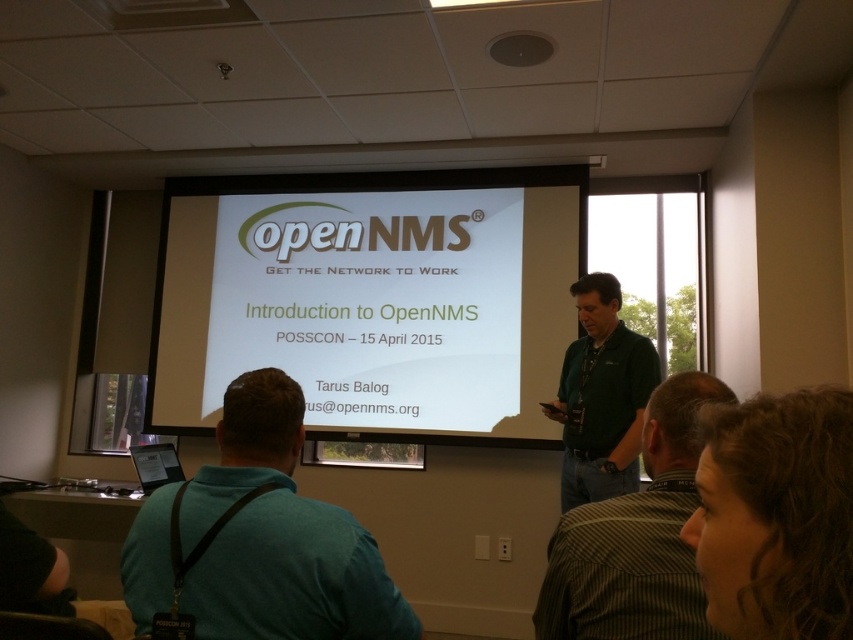
Question: Which of the following is the farthest from the observer?

Choices:
 (A) (x=598, y=515)
 (B) (x=300, y=512)

Answer: (A)

Question: Which object appears farthest from the camera in this image?

Choices:
 (A) teal fabric shirt at lower left
 (B) white glossy projector screen at center
 (C) green shirt at center
 (D) green fabric shirt at center

Answer: (B)

Question: Observing the image, what is the correct spatial positioning of white glossy projector screen at center in reference to green fabric shirt at center?

Choices:
 (A) below
 (B) above

Answer: (B)

Question: Is green shirt at center thinner than green fabric shirt at center?

Choices:
 (A) yes
 (B) no

Answer: (A)

Question: Which object is closer to the camera taking this photo?

Choices:
 (A) white glossy projector screen at center
 (B) green shirt at center
 (C) green fabric shirt at center
 (D) teal fabric shirt at lower left

Answer: (B)

Question: Does teal fabric shirt at lower left appear under green fabric shirt at center?

Choices:
 (A) no
 (B) yes

Answer: (A)